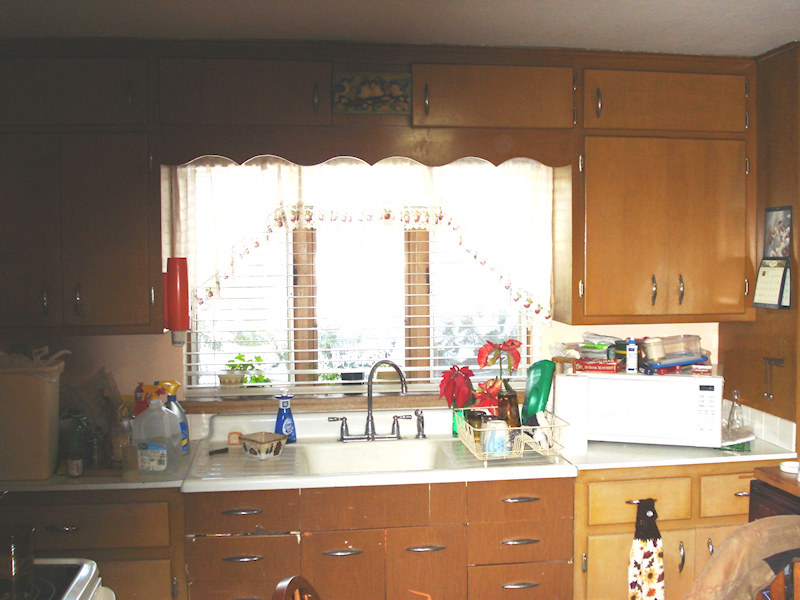
Where is `white coffee mug`? Image resolution: width=800 pixels, height=600 pixels. white coffee mug is located at coordinates (496, 436).